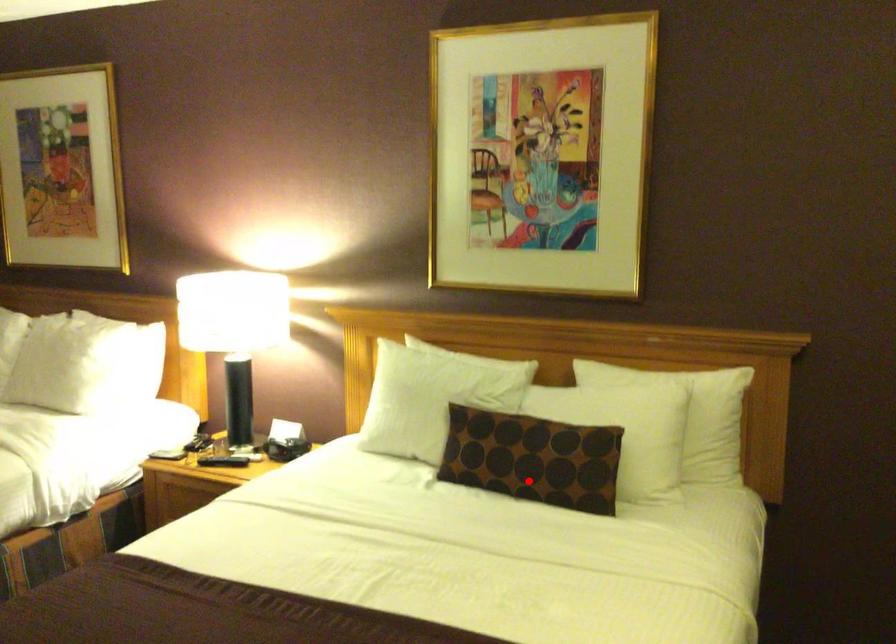
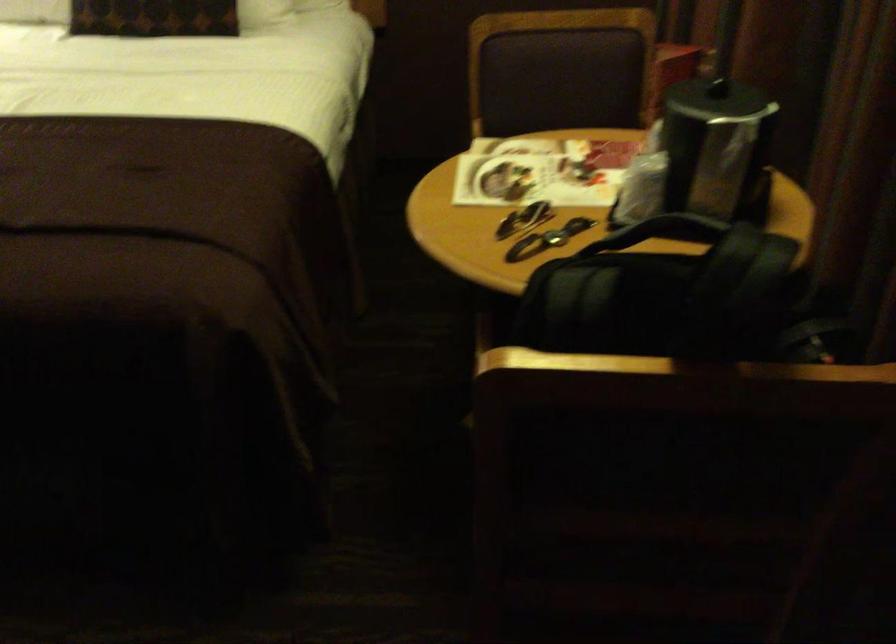
Locate, in the second image, the point that corresponds to the highlighted location in the first image.

(152, 17)